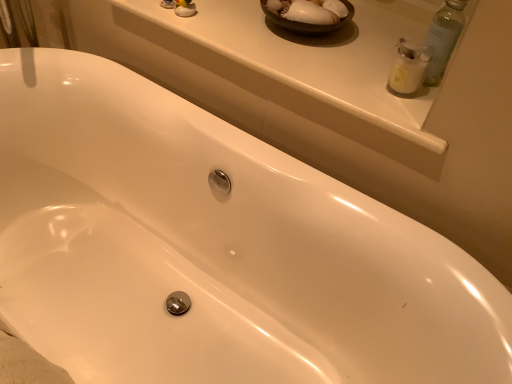
Image resolution: width=512 pixels, height=384 pixels. I want to click on vacant space that is to the left of white matte jar at upper right, so click(x=337, y=80).